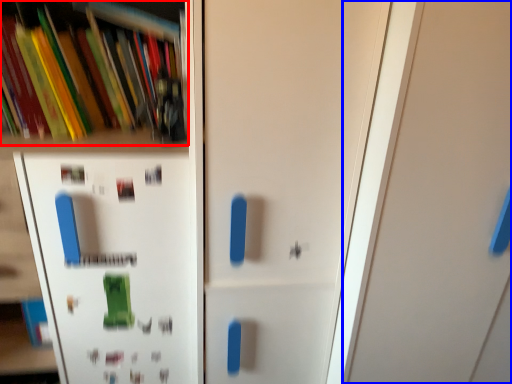
Question: Among these objects, which one is farthest to the camera, book (highlighted by a red box) or door (highlighted by a blue box)?

Choices:
 (A) book
 (B) door

Answer: (A)